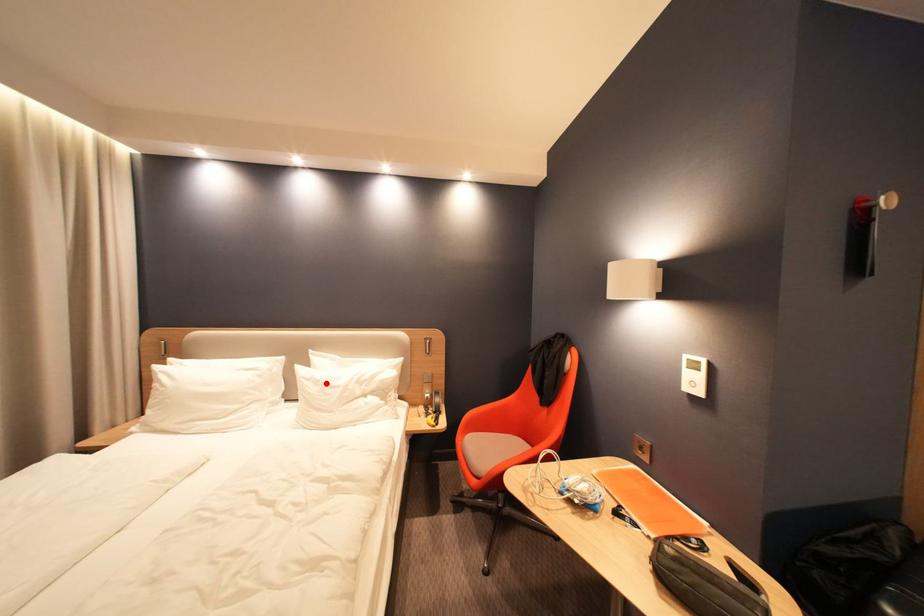
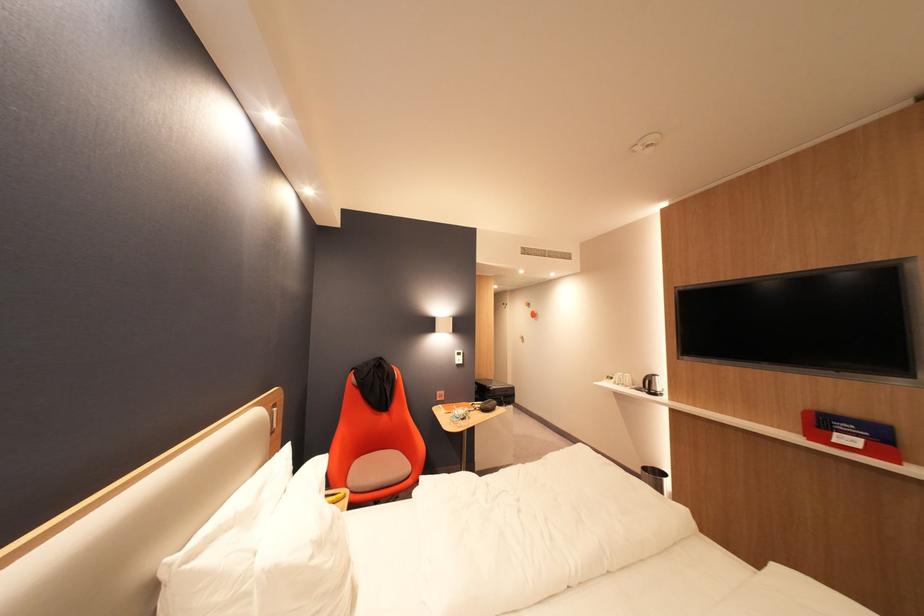
Find the pixel in the second image that matches the highlighted location in the first image.

(330, 545)